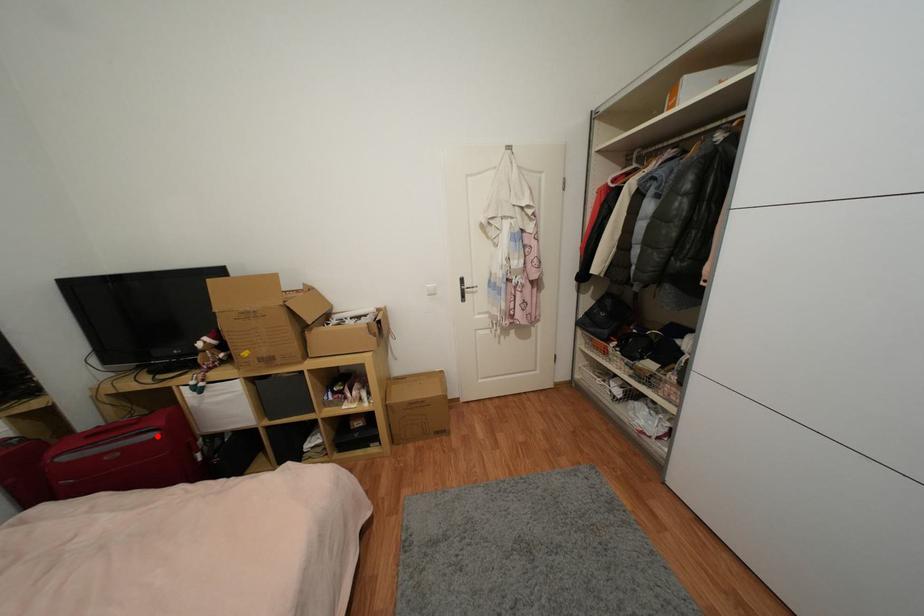
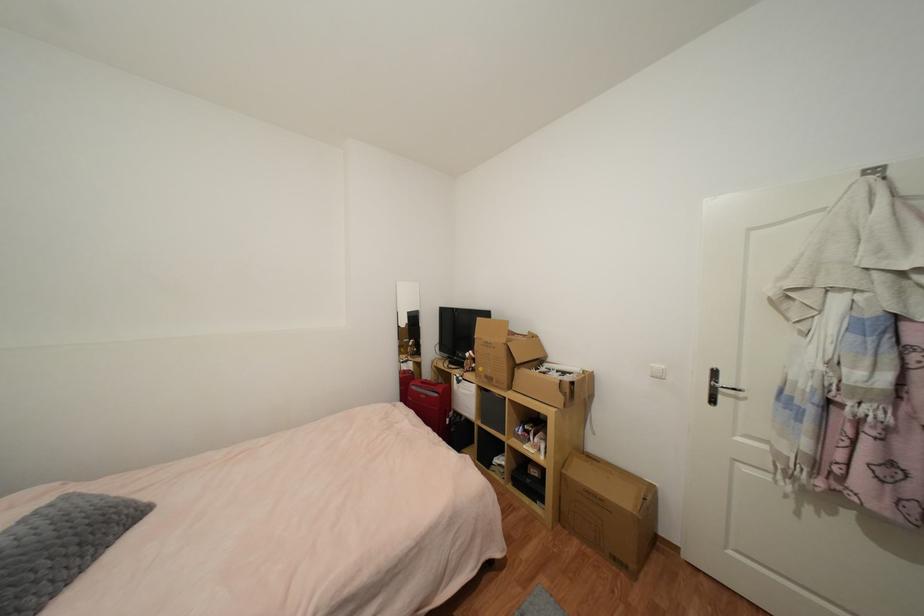
The point at the highlighted location is marked in the first image. Where is the corresponding point in the second image?

(440, 397)